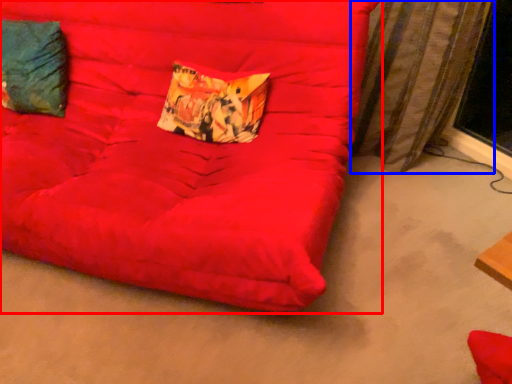
Question: Which of the following is the farthest to the observer, furniture (highlighted by a red box) or curtain (highlighted by a blue box)?

Choices:
 (A) furniture
 (B) curtain

Answer: (B)